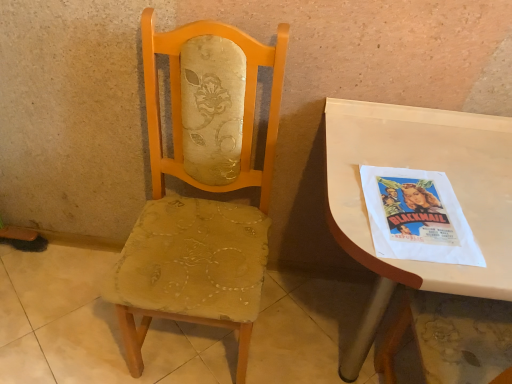
Question: From a real-world perspective, is white glossy desk at right on top of matte yellow fabric chair at center?

Choices:
 (A) yes
 (B) no

Answer: (B)

Question: From a real-world perspective, is white glossy desk at right below matte yellow fabric chair at center?

Choices:
 (A) yes
 (B) no

Answer: (A)

Question: Considering the relative sizes of white glossy desk at right and matte yellow fabric chair at center in the image provided, is white glossy desk at right taller than matte yellow fabric chair at center?

Choices:
 (A) no
 (B) yes

Answer: (A)

Question: Can you confirm if white glossy desk at right is thinner than matte yellow fabric chair at center?

Choices:
 (A) yes
 (B) no

Answer: (B)

Question: Considering the relative sizes of white glossy desk at right and matte yellow fabric chair at center in the image provided, is white glossy desk at right smaller than matte yellow fabric chair at center?

Choices:
 (A) no
 (B) yes

Answer: (A)

Question: From a real-world perspective, relative to white paper poster at right, is worn fabric chair at center vertically above or below?

Choices:
 (A) above
 (B) below

Answer: (B)

Question: Is worn fabric chair at center spatially inside white paper poster at right, or outside of it?

Choices:
 (A) inside
 (B) outside

Answer: (B)

Question: In the image, is worn fabric chair at center on the left side or the right side of white paper poster at right?

Choices:
 (A) left
 (B) right

Answer: (A)

Question: Looking at their shapes, would you say worn fabric chair at center is wider or thinner than white paper poster at right?

Choices:
 (A) thin
 (B) wide

Answer: (B)

Question: Considering the positions of white paper poster at right and worn fabric chair at center in the image, is white paper poster at right bigger or smaller than worn fabric chair at center?

Choices:
 (A) small
 (B) big

Answer: (A)

Question: Considering their positions, is white paper poster at right located in front of or behind worn fabric chair at center?

Choices:
 (A) front
 (B) behind

Answer: (A)

Question: Is white paper poster at right wider or thinner than worn fabric chair at center?

Choices:
 (A) thin
 (B) wide

Answer: (A)

Question: Does point (458, 228) appear closer or farther from the camera than point (205, 340)?

Choices:
 (A) farther
 (B) closer

Answer: (B)

Question: Is white glossy desk at right taller or shorter than worn fabric chair at center?

Choices:
 (A) short
 (B) tall

Answer: (B)

Question: Looking at their shapes, would you say white glossy desk at right is wider or thinner than worn fabric chair at center?

Choices:
 (A) thin
 (B) wide

Answer: (A)